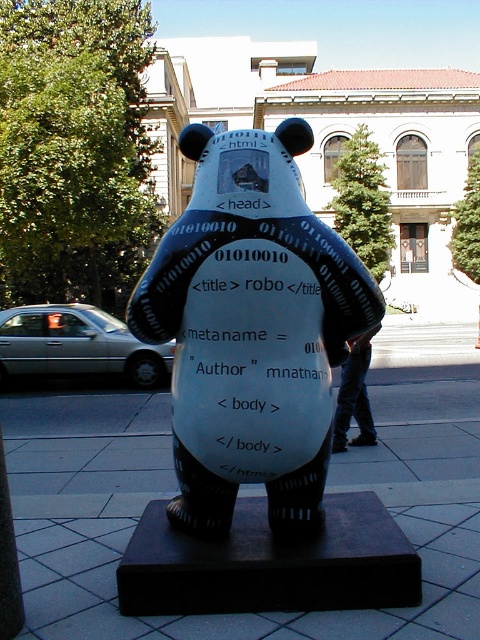
Is white glossy bear at center to the right of smooth concrete pavement at center from the viewer's perspective?

No, white glossy bear at center is not to the right of smooth concrete pavement at center.

Between point (264, 310) and point (93, 550), which one is positioned behind?

The point (93, 550) is behind.

Measure the distance between white glossy bear at center and camera.

9.14 feet

At what (x,y) coordinates should I click in order to perform the action: click on white glossy bear at center. Please return your answer as a coordinate pair (x, y). The image size is (480, 640). Looking at the image, I should click on click(x=252, y=330).